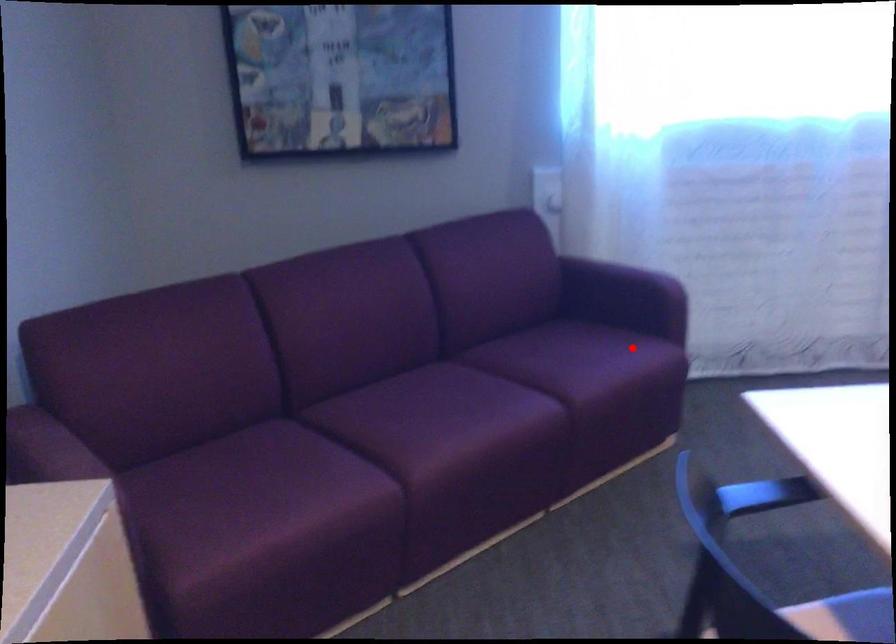
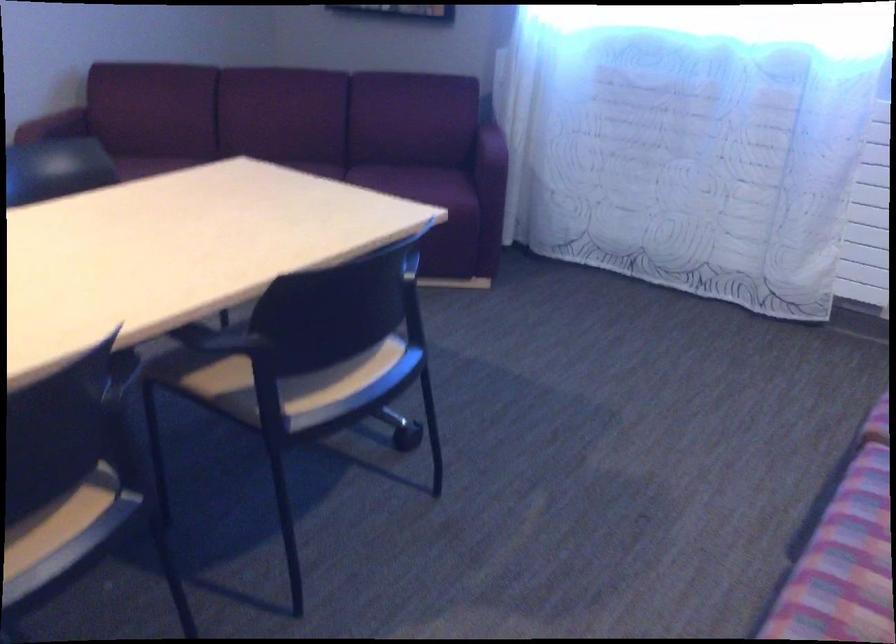
In the second image, find the point that corresponds to the highlighted location in the first image.

(426, 183)